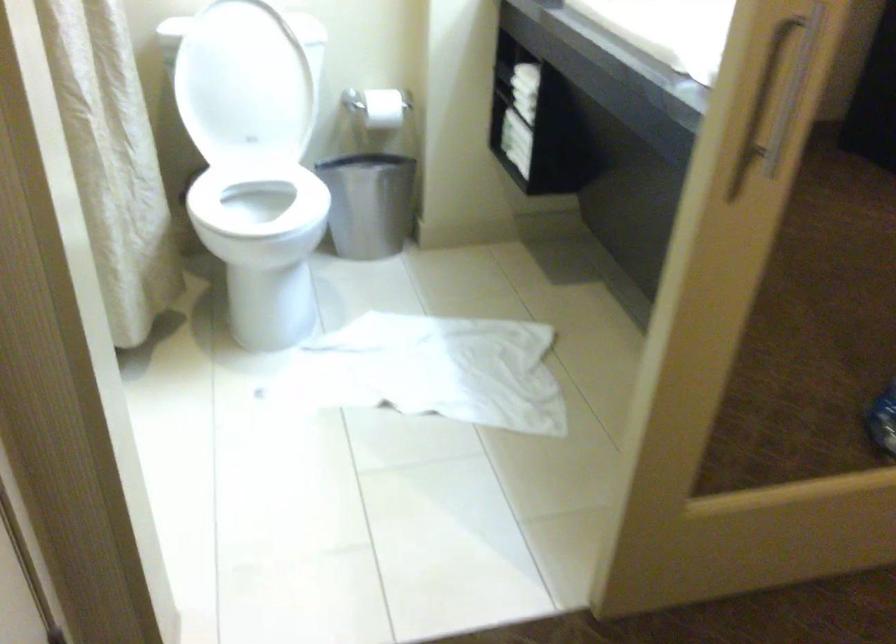
Where is `metal door handle`? The height and width of the screenshot is (644, 896). metal door handle is located at coordinates click(791, 37).